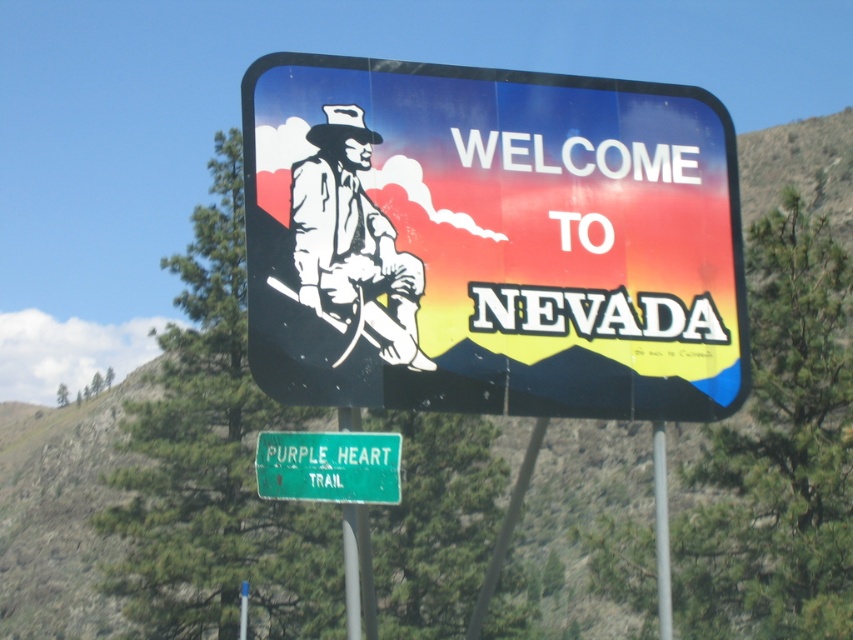
You are standing in front of the Nevada welcome sign and notice two points marked on it. The first point is at coordinates point (341, 108) and the second is at point (360, 474). Which point is closer to you?

Point (341, 108) is further to the viewer than point (360, 474), so the point closer to you is point (360, 474).

You are standing in front of the Nevada welcome sign and notice two points marked on it. The first point is at coordinates point (444, 92) and the second is at point (664, 467). Which point is closer to you?

Point (444, 92) is closer to the camera than point (664, 467), so the first point is closer to you.

You are driving along a road and see the green metallic sign at lower center attached to the metallic gray pole at center. Can you tell if the sign is shorter than the pole?

The green metallic sign at lower center is shorter than the metallic gray pole at center, so yes, the sign is shorter than the pole.